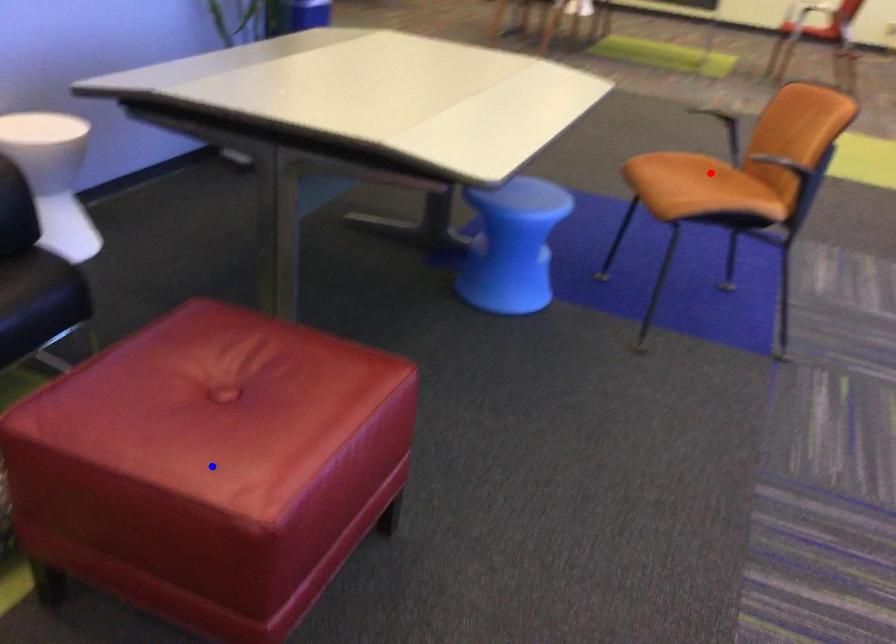
Question: In the image, two points are highlighted. Which point is nearer to the camera? Reply with the corresponding letter.

Choices:
 (A) blue point
 (B) red point

Answer: (A)